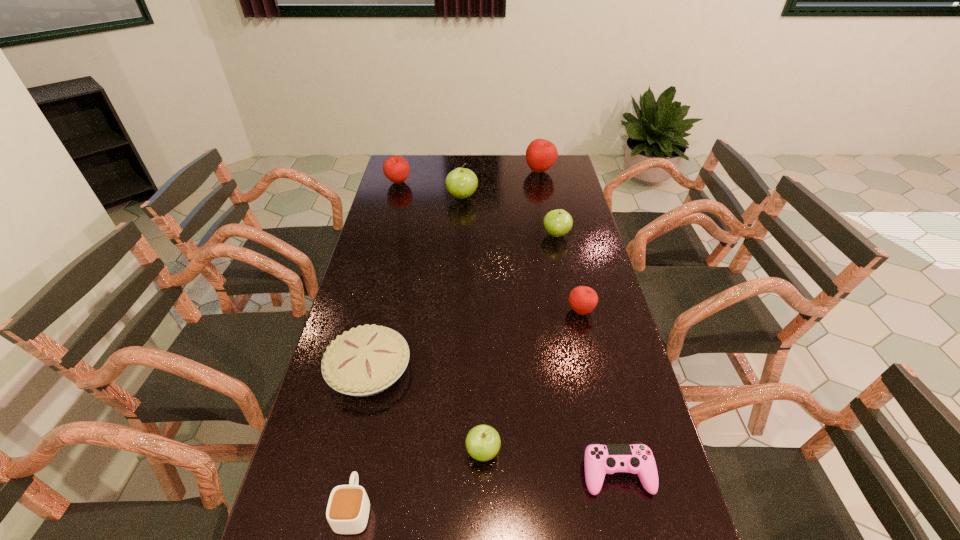
The height and width of the screenshot is (540, 960). I want to click on vacant space located 0.200m on the side with the handle of the cup, so click(x=375, y=402).

At what (x,y) coordinates should I click in order to perform the action: click on free point located 0.270m on the side with the handle of the cup. Please return your answer as a coordinate pair (x, y). The width and height of the screenshot is (960, 540). Looking at the image, I should click on (380, 380).

Image resolution: width=960 pixels, height=540 pixels. What are the coordinates of `free space located on the side with the handle of the cup` in the screenshot? It's located at (376, 396).

Locate an element on the screen. This screenshot has width=960, height=540. vacant point located 0.300m on the back of the pink control is located at coordinates (589, 350).

The height and width of the screenshot is (540, 960). In order to click on apple at the left edge in this screenshot , I will do `click(396, 168)`.

At what (x,y) coordinates should I click in order to perform the action: click on pie positioned at the left edge. Please return your answer as a coordinate pair (x, y). This screenshot has width=960, height=540. Looking at the image, I should click on (366, 360).

Find the location of a particular element. The width and height of the screenshot is (960, 540). cup at the left edge is located at coordinates (348, 508).

Where is `control located in the right edge section of the desktop`? The height and width of the screenshot is (540, 960). control located in the right edge section of the desktop is located at coordinates (637, 458).

Identify the location of object that is positioned at the far left corner. (396, 168).

This screenshot has width=960, height=540. Identify the location of object located at the far right corner. (541, 154).